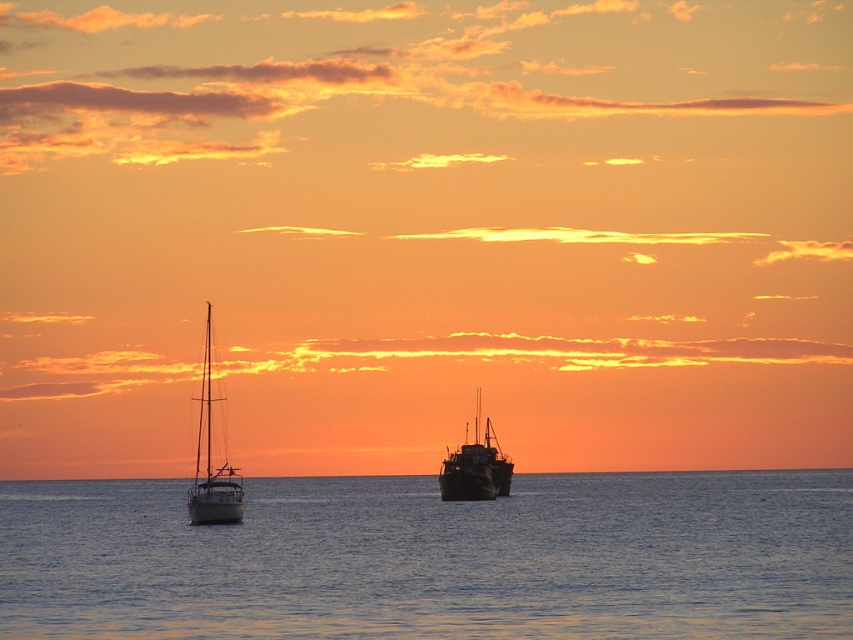
You are standing on the shore looking at the two boats in the sunset scene. Which boat, the shiny white sailboat at left or the rusty metal boat at center, appears nearer to you?

The shiny white sailboat at left appears nearer to you because it is closer to the viewer than the rusty metal boat at center.